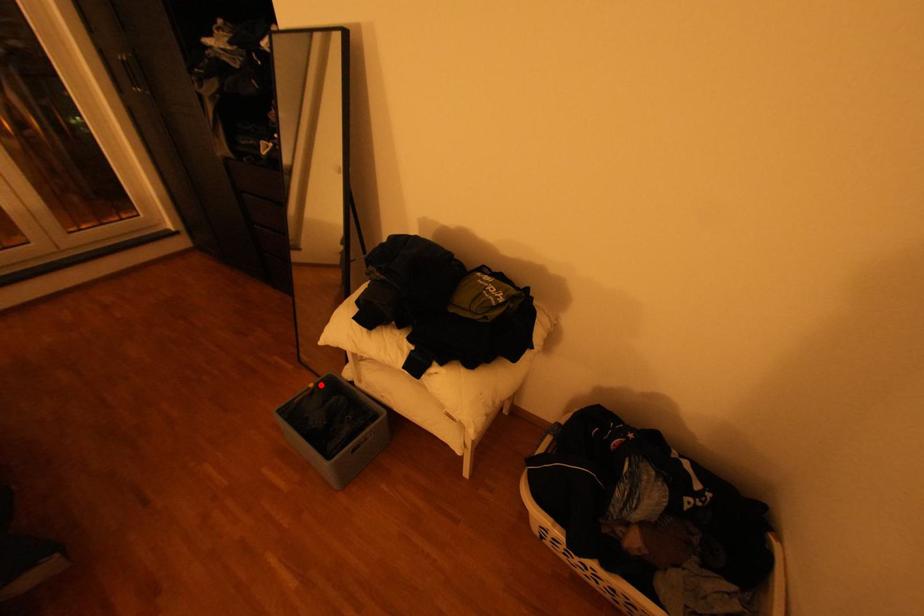
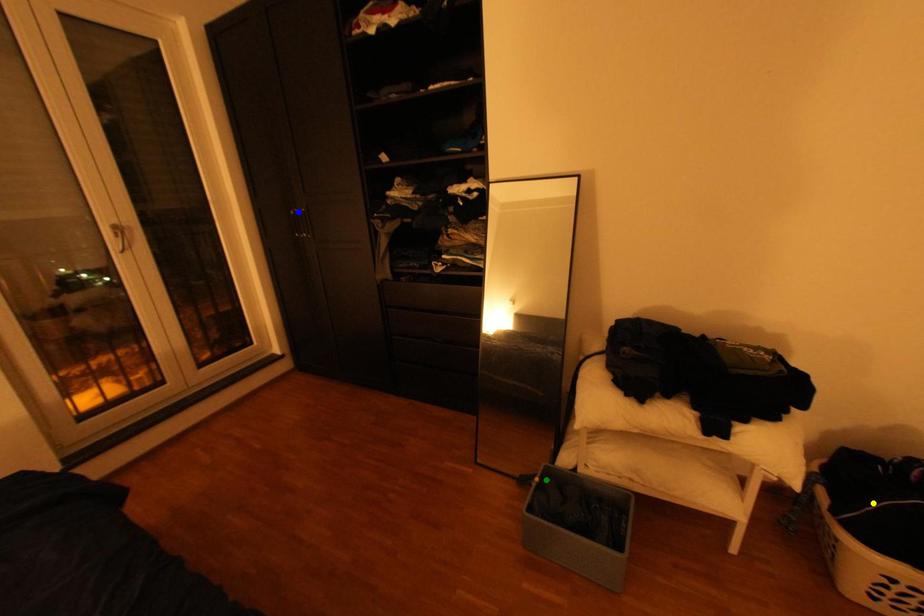
Question: I am providing you with two images of the same scene from different viewpoints. A red point is marked on the first image. You are given multiple points on the second image. Which mark in image 2 goes with the point in image 1?

Choices:
 (A) green point
 (B) yellow point
 (C) blue point

Answer: (A)